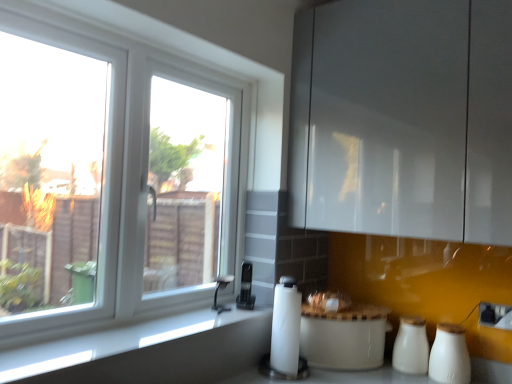
Image resolution: width=512 pixels, height=384 pixels. Identify the location of spots to the right of satin nickel faucet at lower center. (247, 312).